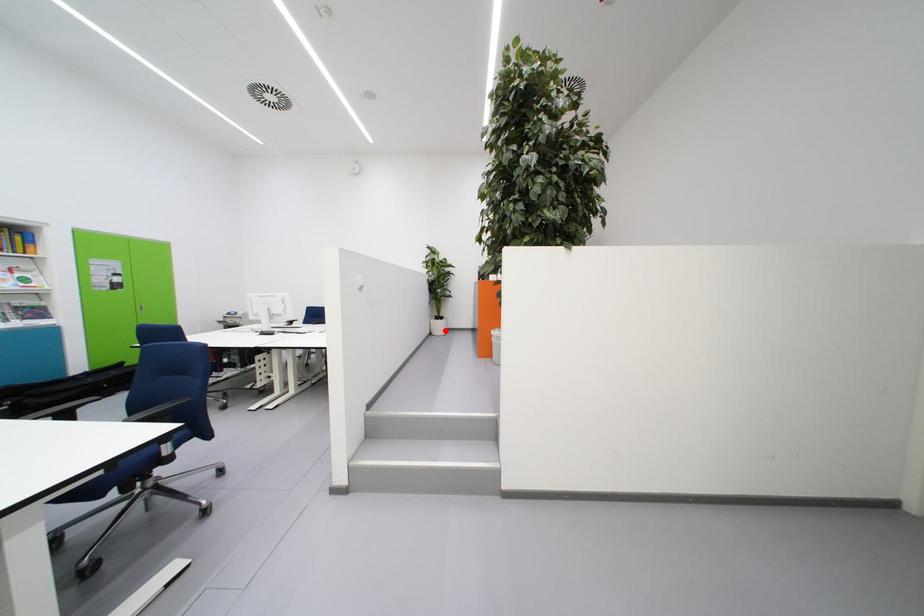
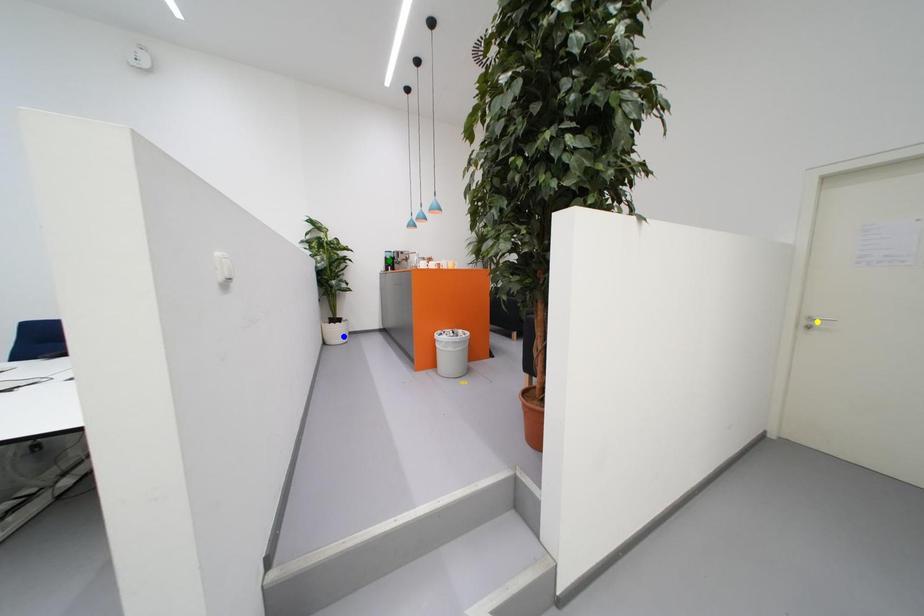
Question: I am providing you with two images of the same scene from different viewpoints. A red point is marked on the first image. You are given multiple points on the second image. Which mark in image 2 goes with the point in image 1?

Choices:
 (A) green point
 (B) blue point
 (C) yellow point

Answer: (B)